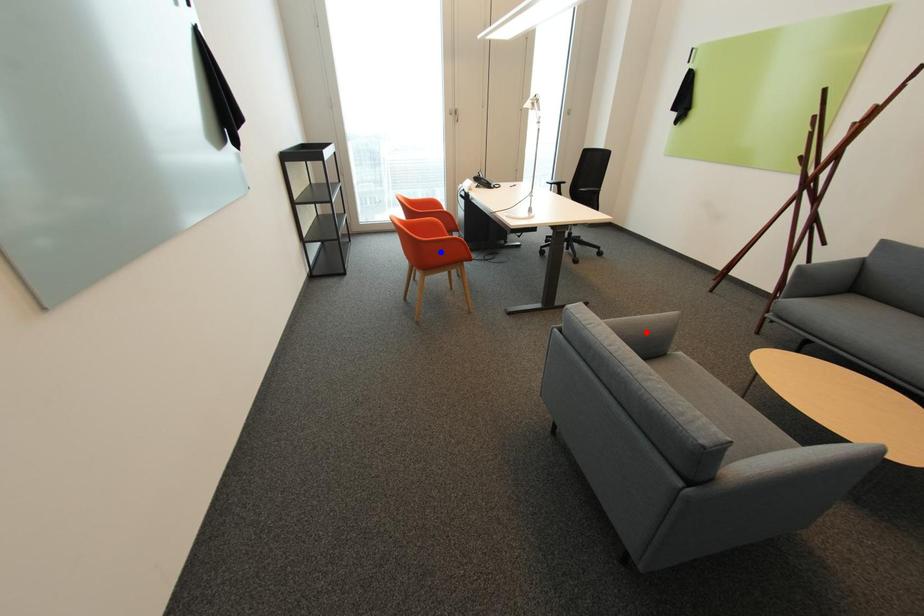
Question: Which of the two points in the image is closer to the camera?

Choices:
 (A) Blue point is closer.
 (B) Red point is closer.

Answer: (B)